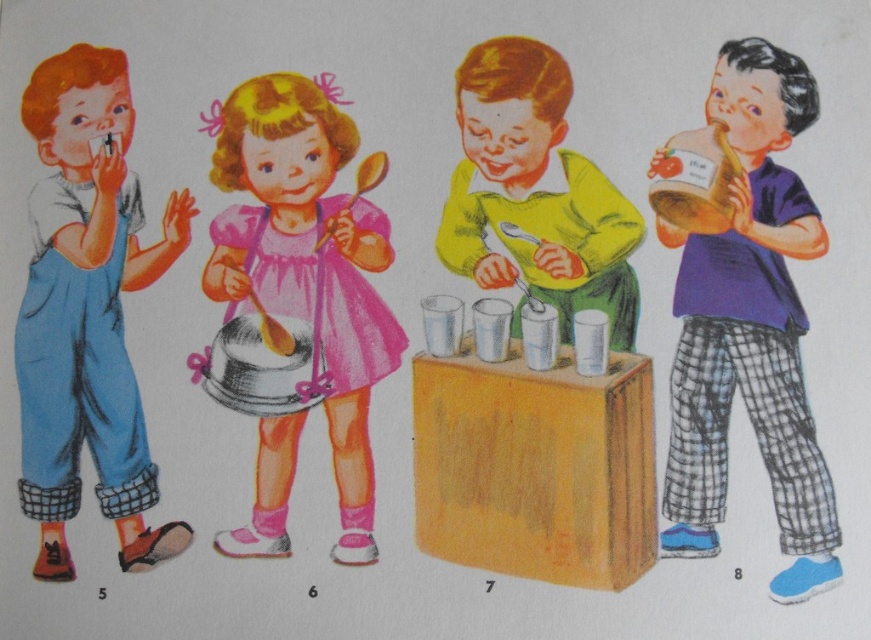
Between purple cotton shirt at right and matte blue overalls at left, which one is positioned higher?

matte blue overalls at left

Consider the image. Is the position of purple cotton shirt at right less distant than that of matte blue overalls at left?

Yes.

The width and height of the screenshot is (871, 640). What do you see at coordinates (750, 330) in the screenshot?
I see `purple cotton shirt at right` at bounding box center [750, 330].

What are the coordinates of `purple cotton shirt at right` in the screenshot? It's located at (750, 330).

Does matte blue overalls at left appear on the right side of matte yellow shirt at center?

No, matte blue overalls at left is not to the right of matte yellow shirt at center.

Does matte blue overalls at left appear over matte yellow shirt at center?

No, matte blue overalls at left is not above matte yellow shirt at center.

Describe the element at coordinates (86, 310) in the screenshot. The width and height of the screenshot is (871, 640). I see `matte blue overalls at left` at that location.

I want to click on matte blue overalls at left, so click(86, 310).

Is the position of purple cotton shirt at right less distant than that of pink satin dress at center?

Yes.

Which is more to the right, purple cotton shirt at right or pink satin dress at center?

Positioned to the right is purple cotton shirt at right.

This screenshot has width=871, height=640. Identify the location of purple cotton shirt at right. (750, 330).